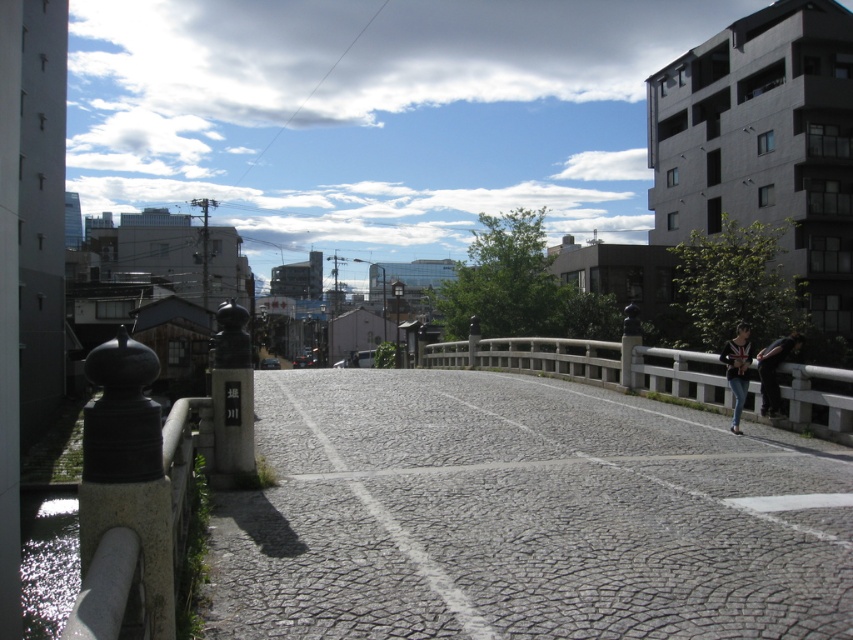
Is denim jacket at right positioned at the back of dark gray fabric jacket at center right?

Yes, it is.

The image size is (853, 640). Describe the element at coordinates (737, 369) in the screenshot. I see `denim jacket at right` at that location.

Is point (733, 410) less distant than point (769, 348)?

No, it is behind (769, 348).

Identify the location of denim jacket at right. The height and width of the screenshot is (640, 853). (737, 369).

Who is taller, white stone rail at right or dark gray fabric jacket at center right?

With more height is white stone rail at right.

The width and height of the screenshot is (853, 640). What are the coordinates of `white stone rail at right` in the screenshot? It's located at (595, 365).

Is white stone rail at right to the right of denim jacket at right from the viewer's perspective?

Incorrect, white stone rail at right is not on the right side of denim jacket at right.

What are the coordinates of `white stone rail at right` in the screenshot? It's located at (595, 365).